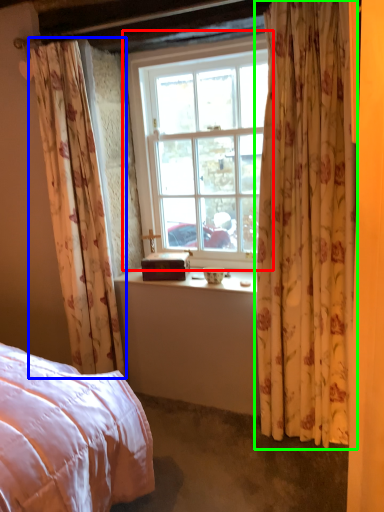
Question: Which object is positioned closest to window (highlighted by a red box)? Select from curtain (highlighted by a blue box) and curtain (highlighted by a green box).

Choices:
 (A) curtain
 (B) curtain

Answer: (A)